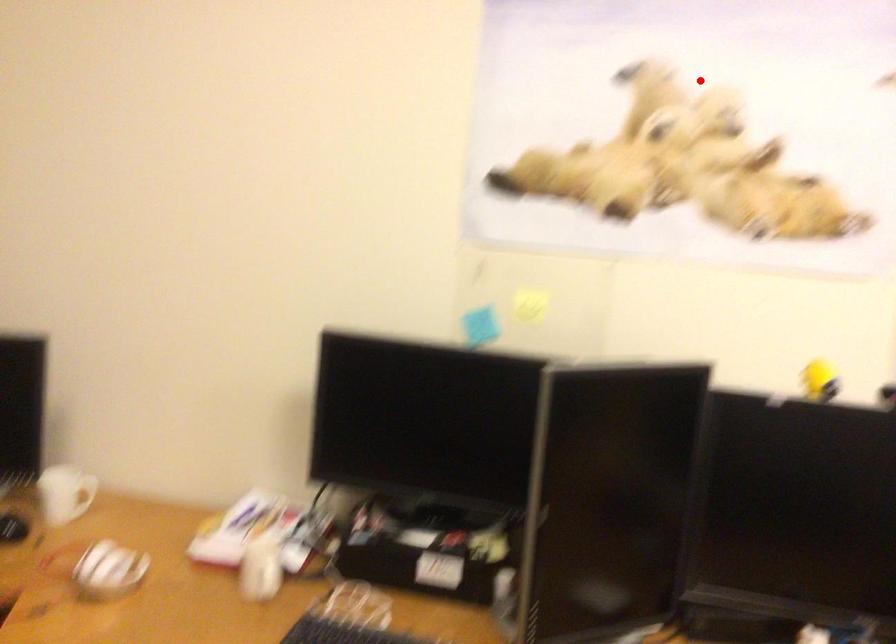
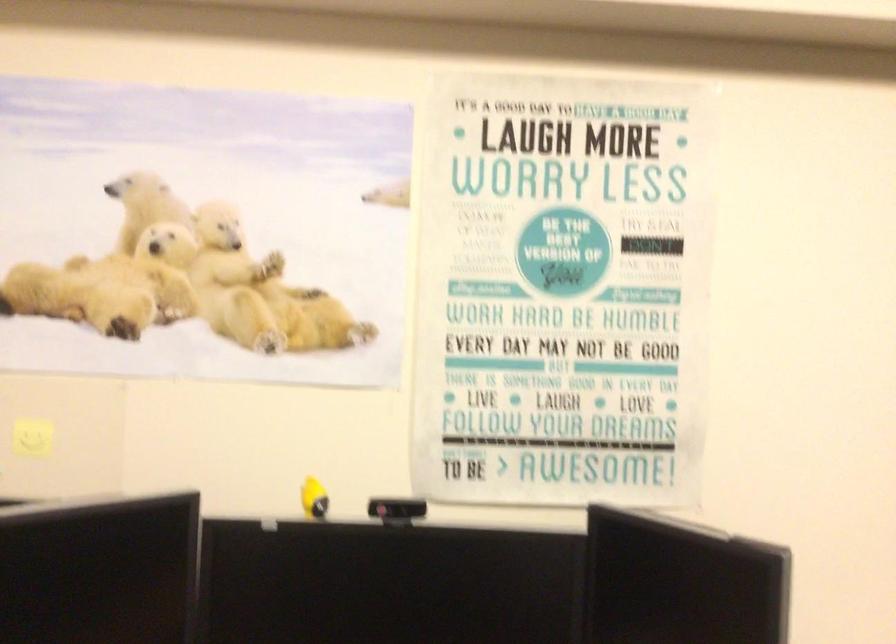
The point at the highlighted location is marked in the first image. Where is the corresponding point in the second image?

(201, 187)